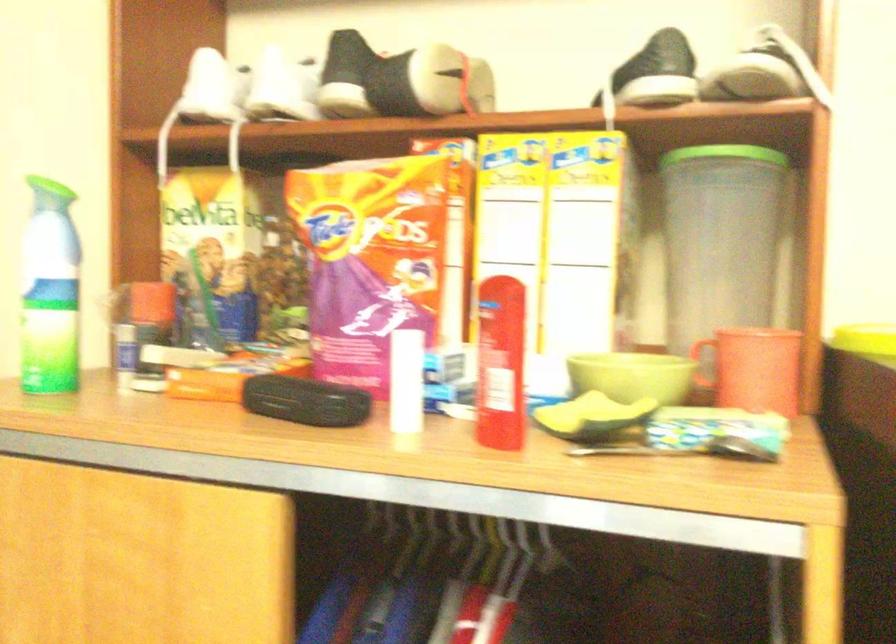
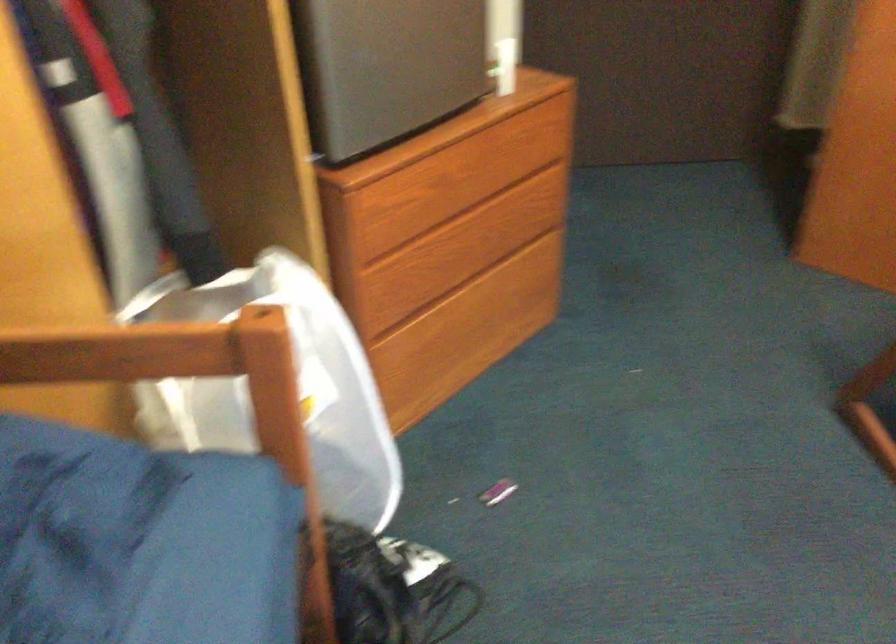
The first image is from the beginning of the video and the second image is from the end. How did the camera likely rotate when shooting the video?

The camera's rotation is toward right-down.